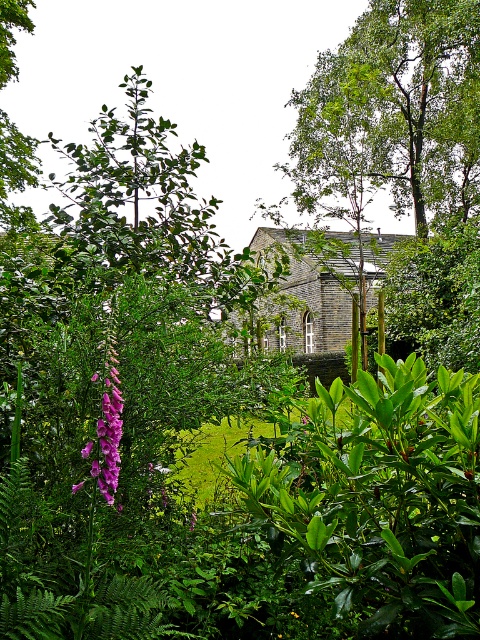
Question: Which point is closer to the camera?

Choices:
 (A) (283, 464)
 (B) (109, 440)

Answer: (B)

Question: Can you confirm if green glossy bush at center is positioned to the left of purple silky flower at left?

Choices:
 (A) yes
 (B) no

Answer: (B)

Question: Among these points, which one is farthest from the camera?

Choices:
 (A) (108, 461)
 (B) (405, 493)

Answer: (B)

Question: Is green glossy bush at center above purple silky flower at left?

Choices:
 (A) no
 (B) yes

Answer: (A)

Question: Can you confirm if green glossy bush at center is positioned to the left of purple silky flower at left?

Choices:
 (A) yes
 (B) no

Answer: (B)